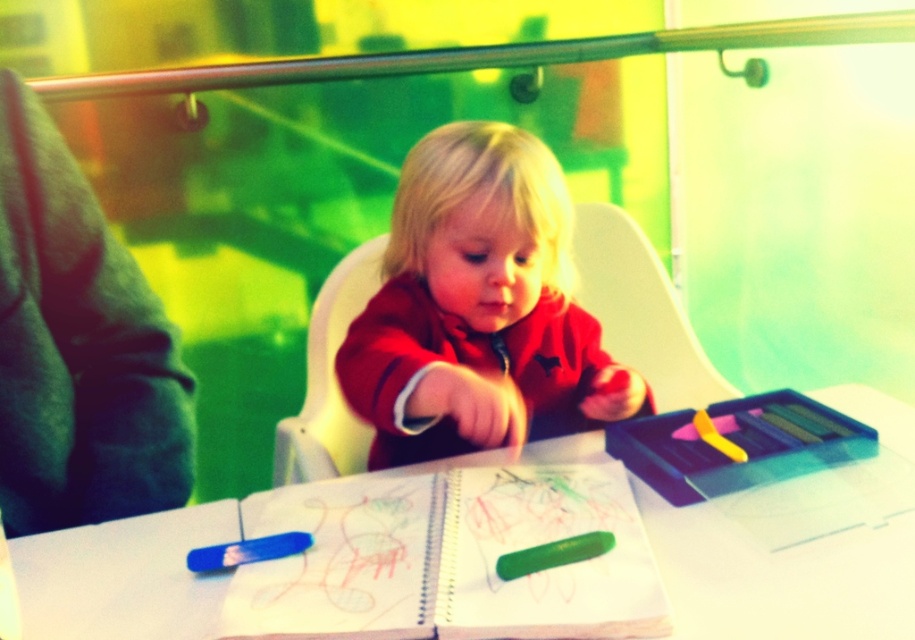
Question: Which object appears farthest from the camera in this image?

Choices:
 (A) green fuzzy sweater at left
 (B) matte red sweater at center
 (C) white paper at center

Answer: (B)

Question: Is white paper at center to the right of green matte notebook at center from the viewer's perspective?

Choices:
 (A) yes
 (B) no

Answer: (A)

Question: Estimate the real-world distances between objects in this image. Which object is closer to the white paper at center?

Choices:
 (A) matte red sweater at center
 (B) green matte notebook at center
 (C) green fuzzy sweater at left

Answer: (B)

Question: From the image, what is the correct spatial relationship of white paper at center in relation to green matte notebook at center?

Choices:
 (A) above
 (B) below

Answer: (A)

Question: Does white paper at center appear over green fuzzy sweater at left?

Choices:
 (A) no
 (B) yes

Answer: (A)

Question: Estimate the real-world distances between objects in this image. Which object is farther from the green fuzzy sweater at left?

Choices:
 (A) green matte notebook at center
 (B) matte red sweater at center
 (C) white paper at center

Answer: (A)